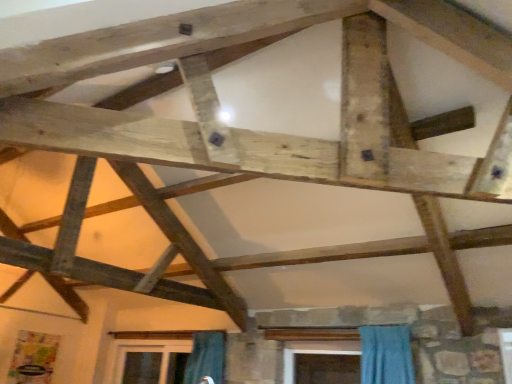
Measure the distance between transparent plastic screen door at lower center and camera.

transparent plastic screen door at lower center and camera are 4.07 meters apart.

Locate an element on the screen. This screenshot has width=512, height=384. transparent plastic screen door at lower center is located at coordinates pos(327,369).

This screenshot has height=384, width=512. Describe the element at coordinates (327, 369) in the screenshot. I see `transparent plastic screen door at lower center` at that location.

Where is `transparent plastic screen door at lower center`? transparent plastic screen door at lower center is located at coordinates (327, 369).